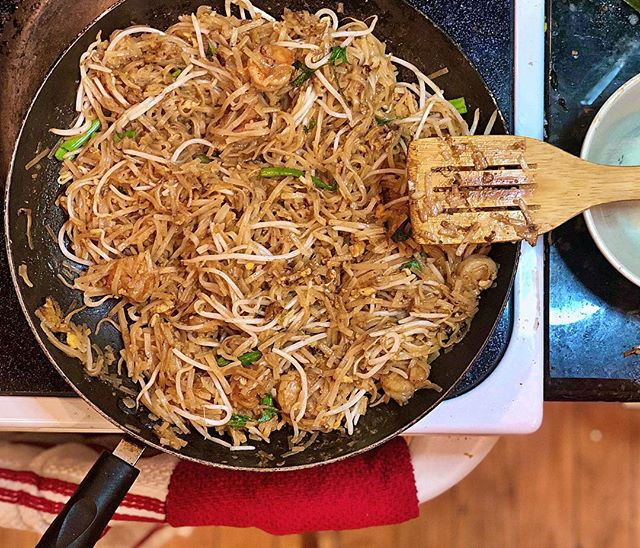
Locate an element on the screen. frying pan is located at coordinates (464, 355).